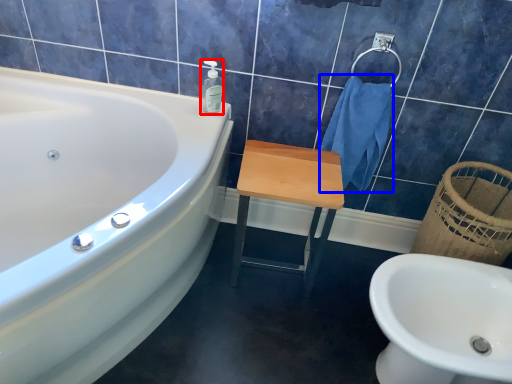
Question: Which object is closer to the camera taking this photo, soap dispenser (highlighted by a red box) or bath towel (highlighted by a blue box)?

Choices:
 (A) soap dispenser
 (B) bath towel

Answer: (B)